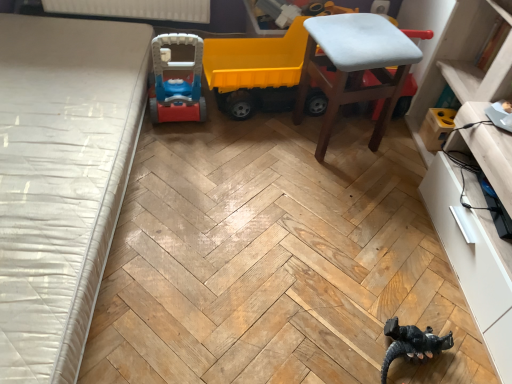
Find the location of `free space between white glossy dresser at lower right and black matte toy dinosaur at lower right`. free space between white glossy dresser at lower right and black matte toy dinosaur at lower right is located at coordinates (419, 281).